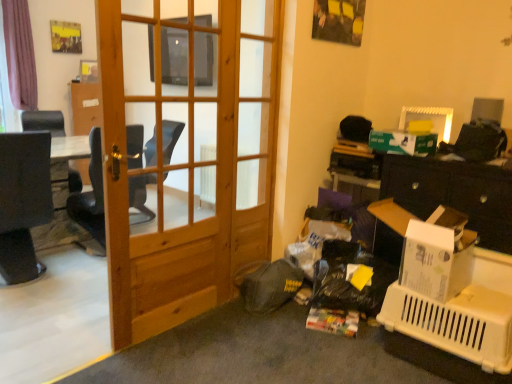
Question: Considering the relative positions of white plastic picture frame at upper right and matte black speaker at upper right in the image provided, is white plastic picture frame at upper right to the left of matte black speaker at upper right from the viewer's perspective?

Choices:
 (A) no
 (B) yes

Answer: (B)

Question: Is the depth of white plastic picture frame at upper right greater than that of matte black speaker at upper right?

Choices:
 (A) yes
 (B) no

Answer: (A)

Question: From the image's perspective, is white plastic picture frame at upper right below matte black speaker at upper right?

Choices:
 (A) no
 (B) yes

Answer: (B)

Question: From a real-world perspective, does white plastic picture frame at upper right stand above matte black speaker at upper right?

Choices:
 (A) yes
 (B) no

Answer: (B)

Question: Is there a large distance between white plastic picture frame at upper right and matte black speaker at upper right?

Choices:
 (A) no
 (B) yes

Answer: (A)

Question: Is white plastic picture frame at upper right thinner than matte black speaker at upper right?

Choices:
 (A) no
 (B) yes

Answer: (B)

Question: Is the depth of white plastic picture frame at upper right greater than that of white cardboard box at right?

Choices:
 (A) no
 (B) yes

Answer: (B)

Question: Is white plastic picture frame at upper right turned away from white cardboard box at right?

Choices:
 (A) yes
 (B) no

Answer: (B)

Question: From a real-world perspective, is white plastic picture frame at upper right below white cardboard box at right?

Choices:
 (A) yes
 (B) no

Answer: (B)

Question: Does white plastic picture frame at upper right have a larger size compared to white cardboard box at right?

Choices:
 (A) no
 (B) yes

Answer: (A)

Question: Is white plastic picture frame at upper right oriented towards white cardboard box at right?

Choices:
 (A) no
 (B) yes

Answer: (A)

Question: Is white plastic picture frame at upper right outside white cardboard box at right?

Choices:
 (A) no
 (B) yes

Answer: (B)

Question: Considering the relative sizes of white plastic picture frame at upper right and black leather chair at left in the image provided, is white plastic picture frame at upper right taller than black leather chair at left?

Choices:
 (A) yes
 (B) no

Answer: (B)